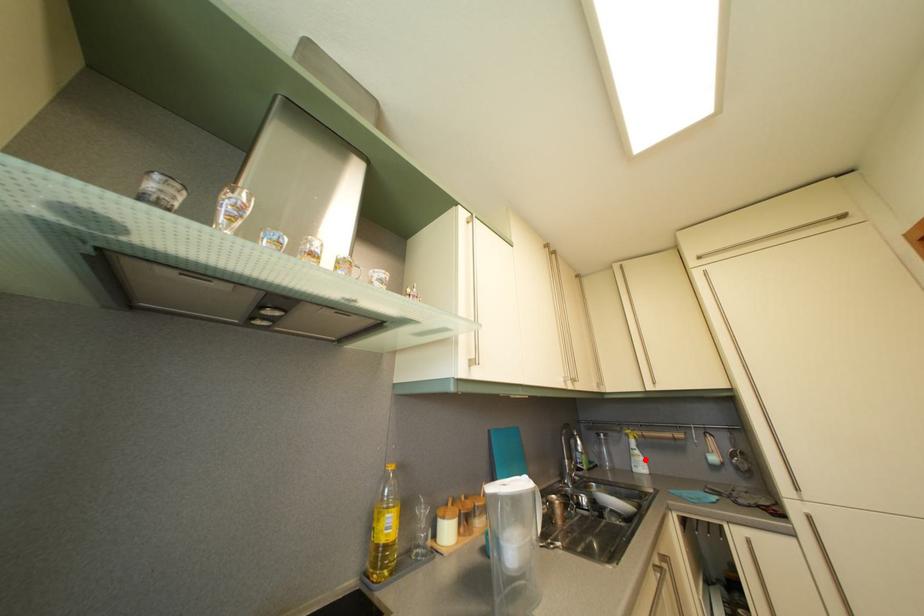
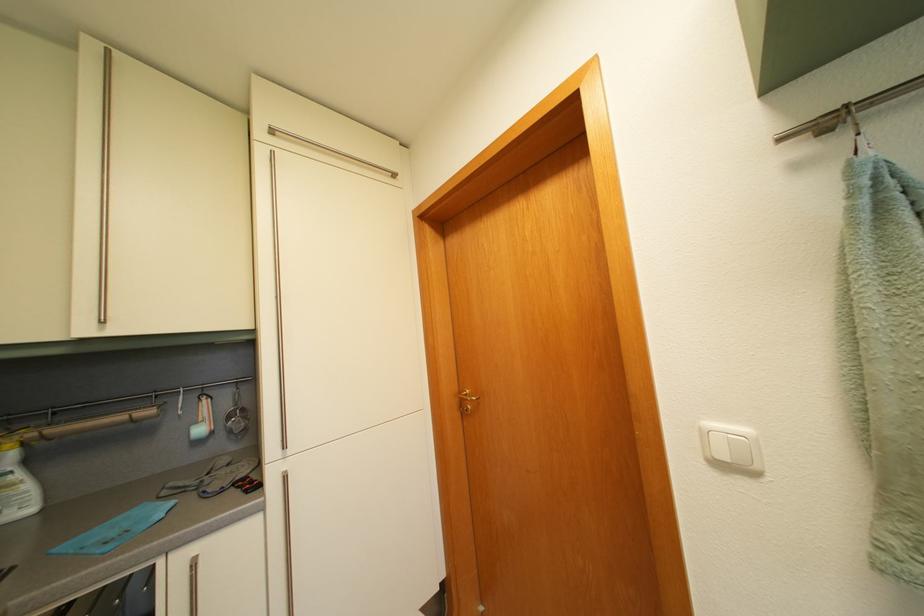
Find the pixel in the second image that matches the highlighted location in the first image.

(26, 484)